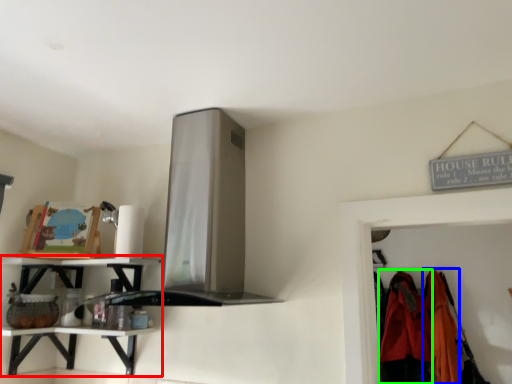
Question: Estimate the real-world distances between objects in this image. Which object is farther from shelf (highlighted by a red box), clothing (highlighted by a blue box) or clothing (highlighted by a green box)?

Choices:
 (A) clothing
 (B) clothing

Answer: (A)